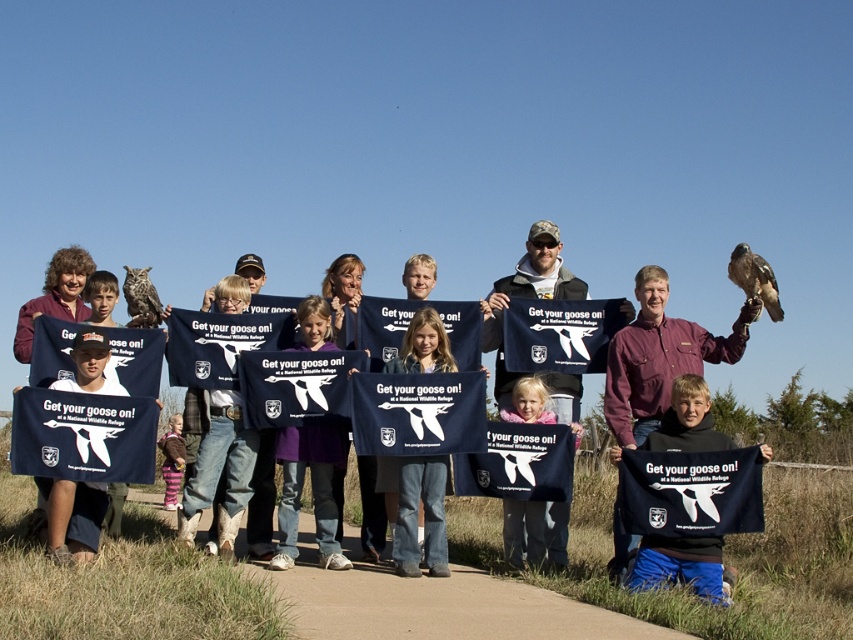
Where is `dark blue t-shirt at center`? The width and height of the screenshot is (853, 640). dark blue t-shirt at center is located at coordinates (311, 488).

Can you confirm if brown feathered falcon at upper right is positioned to the left of matte brown owl at upper left?

Incorrect, brown feathered falcon at upper right is not on the left side of matte brown owl at upper left.

Who is lower down, brown feathered falcon at upper right or matte brown owl at upper left?

matte brown owl at upper left

Is point (778, 312) positioned in front of point (136, 278)?

Yes, it is.

The image size is (853, 640). Identify the location of brown feathered falcon at upper right. (753, 278).

From the picture: Does blue denim jeans at center have a greater height compared to black fabric t-shirt at center?

Indeed, blue denim jeans at center has a greater height compared to black fabric t-shirt at center.

Is blue denim jeans at center above black fabric t-shirt at center?

Actually, blue denim jeans at center is below black fabric t-shirt at center.

Is point (231, 499) more distant than point (666, 564)?

Yes.

Where is `blue denim jeans at center`? blue denim jeans at center is located at coordinates (218, 467).